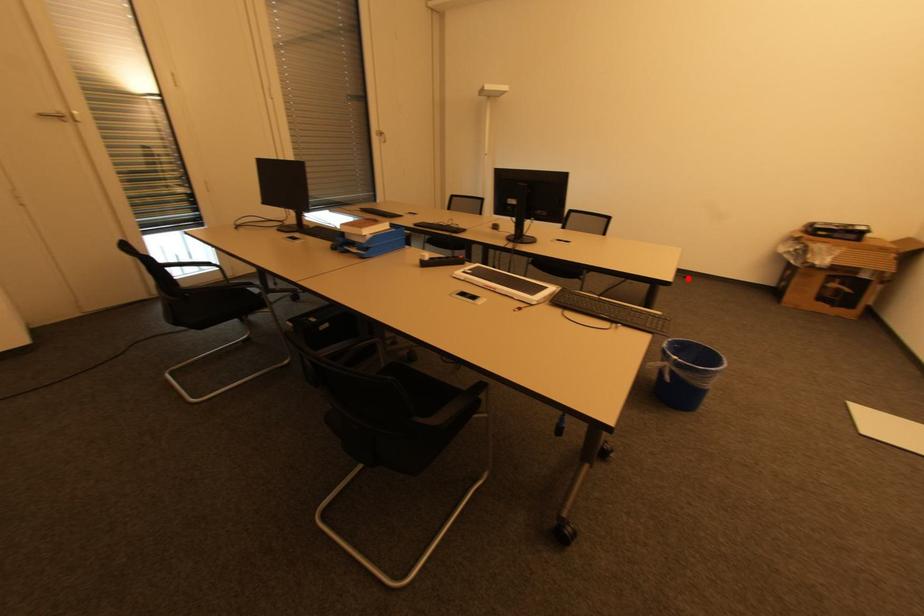
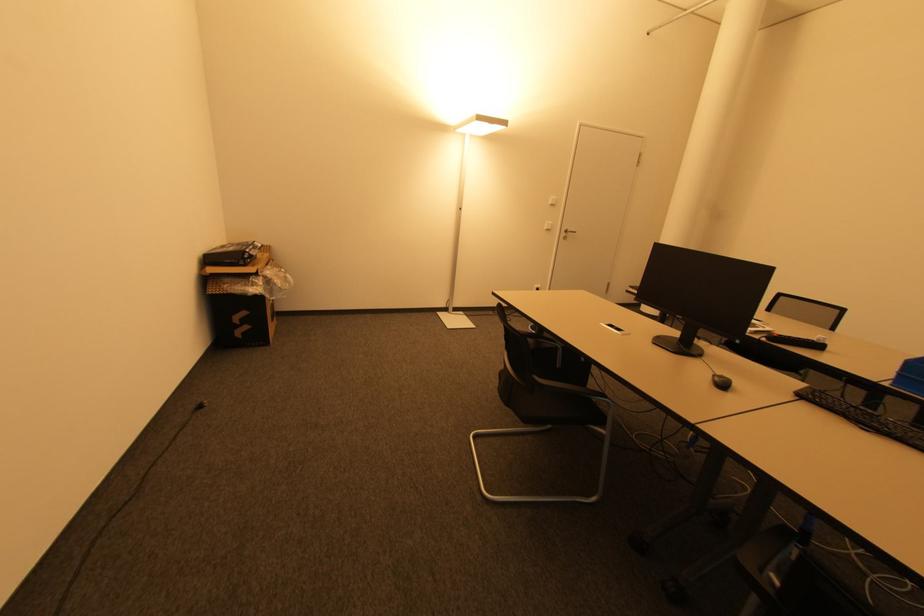
Question: I am providing you with two images of the same scene from different viewpoints. A red point is shown in image1. For the corresponding object point in image2, is it positioned nearer or farther from the camera?

Choices:
 (A) Nearer
 (B) Farther

Answer: (A)